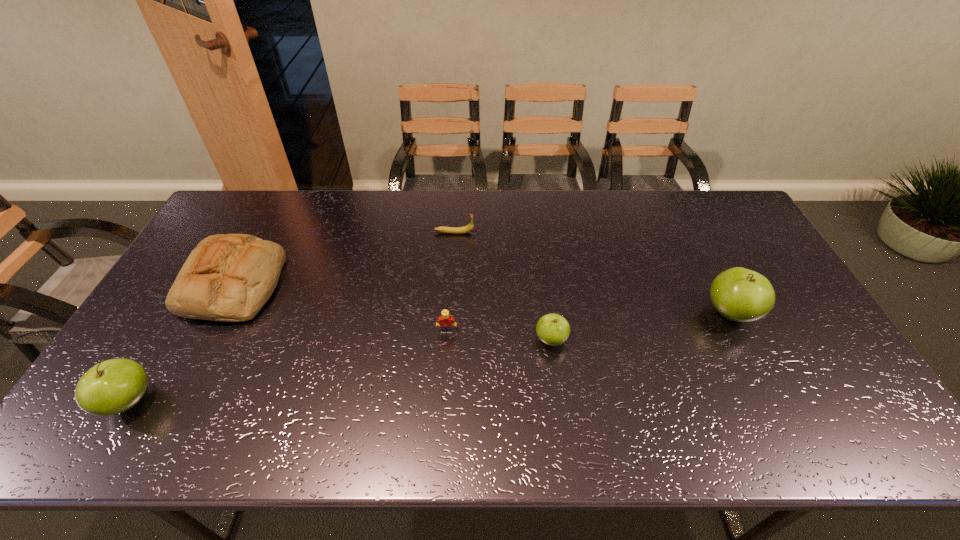
Image resolution: width=960 pixels, height=540 pixels. I want to click on vacant area that lies between the farthest object and the Lego, so (450, 282).

I want to click on free space between the rightmost object and the second object from right to left, so click(x=641, y=327).

At what (x,y) coordinates should I click in order to perform the action: click on empty location between the nearest apple and the farthest object. Please return your answer as a coordinate pair (x, y). This screenshot has width=960, height=540. Looking at the image, I should click on (292, 317).

At what (x,y) coordinates should I click in order to perform the action: click on the third closest object to the bread. Please return your answer as a coordinate pair (x, y). This screenshot has height=540, width=960. Looking at the image, I should click on (446, 322).

Choose which object is the fifth nearest neighbor to the rightmost apple. Please provide its 2D coordinates. Your answer should be formatted as a tuple, i.e. [(x, y)], where the tuple contains the x and y coordinates of a point satisfying the conditions above.

[(111, 387)]

Identify which apple is located as the second nearest to the leftmost apple. Please provide its 2D coordinates. Your answer should be formatted as a tuple, i.e. [(x, y)], where the tuple contains the x and y coordinates of a point satisfying the conditions above.

[(739, 294)]

Locate an element on the screen. This screenshot has width=960, height=540. the closest apple relative to the Lego is located at coordinates (552, 329).

Find the location of a particular element. The width and height of the screenshot is (960, 540). blank area in the image that satisfies the following two spatial constraints: 1. at the stem of the farthest object; 2. on the front side of the bread is located at coordinates (451, 285).